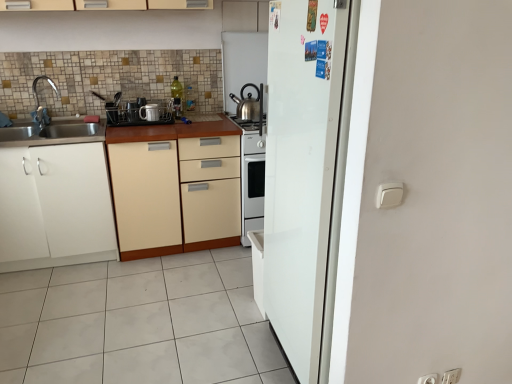
The image size is (512, 384). I want to click on white plastic electric outlet at lower right, which is counted as the first electric outlet, starting from the right, so click(451, 376).

Image resolution: width=512 pixels, height=384 pixels. I want to click on white plastic electric outlet at lower right, the 2th electric outlet positioned from the left, so click(451, 376).

Considering the points (150, 106) and (265, 81), which point is in front, point (150, 106) or point (265, 81)?

The point (150, 106) is closer to the camera.

Is metallic silver pot at center, which is the 2th appliance in left-to-right order, smaller than stainless steel kettle at center, which ranks as the first appliance in right-to-left order?

Correct, metallic silver pot at center, which is the 2th appliance in left-to-right order, occupies less space than stainless steel kettle at center, which ranks as the first appliance in right-to-left order.

Between metallic silver pot at center, which appears as the second appliance when viewed from the right, and stainless steel kettle at center, which is the 3th appliance in left-to-right order, which one is positioned in front?

metallic silver pot at center, which appears as the second appliance when viewed from the right, is in front.

What's the angular difference between metallic dish rack at center, acting as the third appliance starting from the right, and stainless steel kettle at center, which ranks as the first appliance in right-to-left order,'s facing directions?

The facing directions of metallic dish rack at center, acting as the third appliance starting from the right, and stainless steel kettle at center, which ranks as the first appliance in right-to-left order, are 8.66e-05 degrees apart.

From the picture: Is metallic dish rack at center, acting as the third appliance starting from the right, at the right side of stainless steel kettle at center, which ranks as the first appliance in right-to-left order?

No, metallic dish rack at center, acting as the third appliance starting from the right, is not to the right of stainless steel kettle at center, which ranks as the first appliance in right-to-left order.

Consider the image. From the image's perspective, which object appears higher, metallic dish rack at center, the 1th appliance positioned from the left, or stainless steel kettle at center, which is the 3th appliance in left-to-right order?

stainless steel kettle at center, which is the 3th appliance in left-to-right order.

Between metallic dish rack at center, the 1th appliance positioned from the left, and stainless steel kettle at center, which ranks as the first appliance in right-to-left order, which one has smaller width?

With smaller width is stainless steel kettle at center, which ranks as the first appliance in right-to-left order.

Does white matte cabinet at left, placed as the 1th cabinetry when sorted from left to right, turn towards metallic silver kettle at upper center?

No, white matte cabinet at left, placed as the 1th cabinetry when sorted from left to right, is not turned towards metallic silver kettle at upper center.

Can you confirm if white matte cabinet at left, the second cabinetry positioned from the right, is thinner than metallic silver kettle at upper center?

Incorrect, the width of white matte cabinet at left, the second cabinetry positioned from the right, is not less than that of metallic silver kettle at upper center.

Can you see white matte cabinet at left, the second cabinetry positioned from the right, touching metallic silver kettle at upper center?

white matte cabinet at left, the second cabinetry positioned from the right, and metallic silver kettle at upper center are clearly separated.

Is white matte cabinet at left, the second cabinetry positioned from the right, to the right of metallic silver kettle at upper center from the viewer's perspective?

Incorrect, white matte cabinet at left, the second cabinetry positioned from the right, is not on the right side of metallic silver kettle at upper center.

Considering the sizes of objects white plastic electric outlet at lower right, which is counted as the first electric outlet, starting from the right, and metallic dish rack at center, acting as the third appliance starting from the right, in the image provided, who is thinner, white plastic electric outlet at lower right, which is counted as the first electric outlet, starting from the right, or metallic dish rack at center, acting as the third appliance starting from the right,?

white plastic electric outlet at lower right, which is counted as the first electric outlet, starting from the right.

Is point (454, 382) closer or farther from the camera than point (129, 111)?

Point (454, 382) is closer to the camera than point (129, 111).

Measure the distance from white plastic electric outlet at lower right, which is counted as the first electric outlet, starting from the right, to metallic dish rack at center, acting as the third appliance starting from the right.

white plastic electric outlet at lower right, which is counted as the first electric outlet, starting from the right, is 7.75 feet from metallic dish rack at center, acting as the third appliance starting from the right.

Is metallic dish rack at center, acting as the third appliance starting from the right, surrounded by white plastic electric outlet at lower right, the 2th electric outlet positioned from the left?

No, white plastic electric outlet at lower right, the 2th electric outlet positioned from the left, does not contain metallic dish rack at center, acting as the third appliance starting from the right.

From a real-world perspective, which object stands above the other?

brushed metal faucet at left.

Are white tile floor at lower center and brushed metal faucet at left far apart?

Yes, white tile floor at lower center is far from brushed metal faucet at left.

Considering the positions of points (13, 361) and (42, 121), is point (13, 361) closer to camera compared to point (42, 121)?

Yes, it is.

How many degrees apart are the facing directions of white tile floor at lower center and brushed metal faucet at left?

The angle between the facing direction of white tile floor at lower center and the facing direction of brushed metal faucet at left is 170 degrees.

Is metallic silver pot at center, which appears as the second appliance when viewed from the right, wider or thinner than metallic dish rack at center, the 1th appliance positioned from the left?

In the image, metallic silver pot at center, which appears as the second appliance when viewed from the right, appears to be more narrow than metallic dish rack at center, the 1th appliance positioned from the left.

Is point (145, 105) closer or farther from the camera than point (119, 105)?

Point (145, 105) appears to be farther away from the viewer than point (119, 105).

Looking at this image, from a real-world perspective, is metallic silver pot at center, which appears as the second appliance when viewed from the right, on top of metallic dish rack at center, the 1th appliance positioned from the left?

Yes, from a real-world perspective, metallic silver pot at center, which appears as the second appliance when viewed from the right, is on top of metallic dish rack at center, the 1th appliance positioned from the left.

Could you tell me if metallic dish rack at center, the 1th appliance positioned from the left, is facing metallic silver pot at center, which appears as the second appliance when viewed from the right?

Yes.

Considering the sizes of metallic dish rack at center, the 1th appliance positioned from the left, and metallic silver pot at center, which appears as the second appliance when viewed from the right, in the image, is metallic dish rack at center, the 1th appliance positioned from the left, taller or shorter than metallic silver pot at center, which appears as the second appliance when viewed from the right,?

Clearly, metallic dish rack at center, the 1th appliance positioned from the left, is taller compared to metallic silver pot at center, which appears as the second appliance when viewed from the right.

Which object is wider, metallic dish rack at center, the 1th appliance positioned from the left, or metallic silver pot at center, which appears as the second appliance when viewed from the right?

Wider between the two is metallic dish rack at center, the 1th appliance positioned from the left.

From a real-world perspective, which object stands above the other?

In real-world perspective, metallic silver pot at center, which appears as the second appliance when viewed from the right, is above.

The image size is (512, 384). Identify the location of the 2nd appliance above the metallic silver pot at center, which is the 2th appliance in left-to-right order (from the image's perspective). (243, 62).

Identify the location of the 2nd appliance located above the metallic dish rack at center, acting as the third appliance starting from the right (from a real-world perspective). This screenshot has height=384, width=512. (243, 62).

When comparing their distances from metallic silver kettle at upper center, does stainless steel kettle at center, which ranks as the first appliance in right-to-left order, or white matte cabinet at left, placed as the 1th cabinetry when sorted from left to right, seem further?

The object further to metallic silver kettle at upper center is white matte cabinet at left, placed as the 1th cabinetry when sorted from left to right.

Which object lies further to the anchor point stainless steel kettle at center, which is the 3th appliance in left-to-right order, brushed metal faucet at left or metallic silver pot at center, which is the 2th appliance in left-to-right order?

brushed metal faucet at left.

Estimate the real-world distances between objects in this image. Which object is further from metallic silver pot at center, which appears as the second appliance when viewed from the right, white plastic electric outlet at lower right, the 1th electric outlet from the left, or white matte cabinet at left, placed as the 1th cabinetry when sorted from left to right?

Based on the image, white plastic electric outlet at lower right, the 1th electric outlet from the left, appears to be further to metallic silver pot at center, which appears as the second appliance when viewed from the right.

Which object lies nearer to the anchor point white plastic electric outlet at lower right, the 2th electric outlet positioned from the left, metallic dish rack at center, the 1th appliance positioned from the left, or stainless steel kettle at center, which is the 3th appliance in left-to-right order?

stainless steel kettle at center, which is the 3th appliance in left-to-right order, lies closer to white plastic electric outlet at lower right, the 2th electric outlet positioned from the left, than the other object.

Based on their spatial positions, is beige matte cabinet at center, positioned as the first cabinetry in right-to-left order, or white plastic electric outlet at lower right, the 2th electric outlet positioned from the left, further from white matte cabinet at left, placed as the 1th cabinetry when sorted from left to right?

Based on the image, white plastic electric outlet at lower right, the 2th electric outlet positioned from the left, appears to be further to white matte cabinet at left, placed as the 1th cabinetry when sorted from left to right.

Based on their spatial positions, is white plastic electric outlet at lower right, which is counted as the first electric outlet, starting from the right, or stainless steel kettle at center, which is the 3th appliance in left-to-right order, closer to white matte cabinet at left, the second cabinetry positioned from the right?

stainless steel kettle at center, which is the 3th appliance in left-to-right order, is closer to white matte cabinet at left, the second cabinetry positioned from the right.

From the image, which object appears to be farther from white plastic electric outlet at lower right, the 1th electric outlet from the left, metallic dish rack at center, the 1th appliance positioned from the left, or beige matte cabinet at center, positioned as the first cabinetry in right-to-left order?

metallic dish rack at center, the 1th appliance positioned from the left, is positioned further to the anchor white plastic electric outlet at lower right, the 1th electric outlet from the left.

Estimate the real-world distances between objects in this image. Which object is closer to metallic silver kettle at upper center, metallic silver pot at center, which is the 2th appliance in left-to-right order, or white matte cabinet at left, the second cabinetry positioned from the right?

The object closer to metallic silver kettle at upper center is metallic silver pot at center, which is the 2th appliance in left-to-right order.

Image resolution: width=512 pixels, height=384 pixels. I want to click on cabinetry between metallic dish rack at center, the 1th appliance positioned from the left, and metallic silver kettle at upper center, in the horizontal direction, so click(176, 194).

The width and height of the screenshot is (512, 384). I want to click on cabinetry between brushed metal faucet at left and white plastic electric outlet at lower right, the 1th electric outlet from the left, from left to right, so click(x=176, y=194).

Locate an element on the screen. The image size is (512, 384). kitchen appliance between stainless steel kettle at center, which is the 3th appliance in left-to-right order, and white plastic electric outlet at lower right, the 2th electric outlet positioned from the left, in the vertical direction is located at coordinates (249, 104).

Find the location of a particular element. The width and height of the screenshot is (512, 384). plain located between white matte cabinet at left, placed as the 1th cabinetry when sorted from left to right, and white plastic electric outlet at lower right, the 2th electric outlet positioned from the left, in the left-right direction is located at coordinates (138, 323).